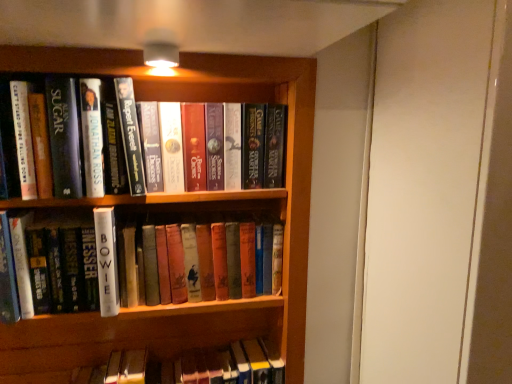
Question: Could you tell me if hardcover books at center, positioned as the 3th book in bottom-to-top order, is turned towards white matte book at center, which ranks as the 3th book in top-to-bottom order?

Choices:
 (A) no
 (B) yes

Answer: (A)

Question: Is hardcover books at center, positioned as the 3th book in bottom-to-top order, positioned with its back to white matte book at center, the 1th book when ordered from bottom to top?

Choices:
 (A) no
 (B) yes

Answer: (A)

Question: Can you confirm if hardcover books at center, positioned as the 3th book in bottom-to-top order, is positioned to the right of white matte book at center, the 1th book when ordered from bottom to top?

Choices:
 (A) yes
 (B) no

Answer: (A)

Question: Can you confirm if hardcover books at center, positioned as the 3th book in bottom-to-top order, is smaller than white matte book at center, which ranks as the 3th book in top-to-bottom order?

Choices:
 (A) no
 (B) yes

Answer: (B)

Question: Is white matte book at center, the 1th book when ordered from bottom to top, completely or partially inside hardcover books at center, the 1th book from the top?

Choices:
 (A) no
 (B) yes

Answer: (A)

Question: Is point (296, 365) positioned closer to the camera than point (224, 284)?

Choices:
 (A) farther
 (B) closer

Answer: (A)

Question: From a real-world perspective, is wooden bookcase at center positioned above or below white matte book at center, which ranks as the 3th book in top-to-bottom order?

Choices:
 (A) above
 (B) below

Answer: (B)

Question: Considering the relative positions of wooden bookcase at center and white matte book at center, which ranks as the 3th book in top-to-bottom order, in the image provided, is wooden bookcase at center to the left or to the right of white matte book at center, which ranks as the 3th book in top-to-bottom order,?

Choices:
 (A) left
 (B) right

Answer: (B)

Question: In terms of width, does wooden bookcase at center look wider or thinner when compared to white matte book at center, the 1th book when ordered from bottom to top?

Choices:
 (A) wide
 (B) thin

Answer: (A)

Question: Looking at the image, does white matte book at center, the 1th book when ordered from bottom to top, seem bigger or smaller compared to hardcover book at upper left, which is the 2th book from bottom to top?

Choices:
 (A) big
 (B) small

Answer: (A)

Question: Considering the relative positions of white matte book at center, which ranks as the 3th book in top-to-bottom order, and hardcover book at upper left, which is the 2th book from bottom to top, in the image provided, is white matte book at center, which ranks as the 3th book in top-to-bottom order, to the left or to the right of hardcover book at upper left, which is the 2th book from bottom to top,?

Choices:
 (A) left
 (B) right

Answer: (B)

Question: Choose the correct answer: Is white matte book at center, which ranks as the 3th book in top-to-bottom order, inside hardcover book at upper left, the second book when ordered from top to bottom, or outside it?

Choices:
 (A) inside
 (B) outside

Answer: (B)

Question: Is white matte book at center, the 1th book when ordered from bottom to top, wider or thinner than hardcover book at upper left, the second book when ordered from top to bottom?

Choices:
 (A) wide
 (B) thin

Answer: (B)

Question: Based on their sizes in the image, would you say hardcover books at center, the 1th book from the top, is bigger or smaller than hardcover book at upper left, the second book when ordered from top to bottom?

Choices:
 (A) small
 (B) big

Answer: (A)

Question: Is hardcover books at center, the 1th book from the top, taller or shorter than hardcover book at upper left, the second book when ordered from top to bottom?

Choices:
 (A) short
 (B) tall

Answer: (A)